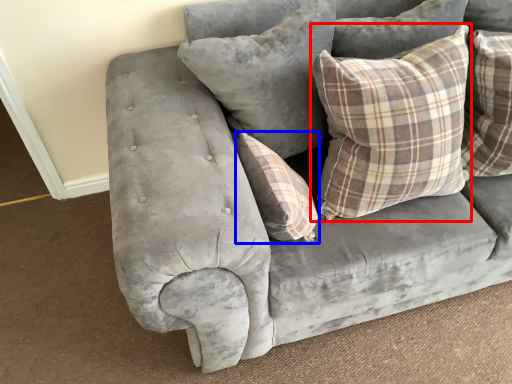
Question: Which object appears closest to the camera in this image, pillow (highlighted by a red box) or pillow (highlighted by a blue box)?

Choices:
 (A) pillow
 (B) pillow

Answer: (A)